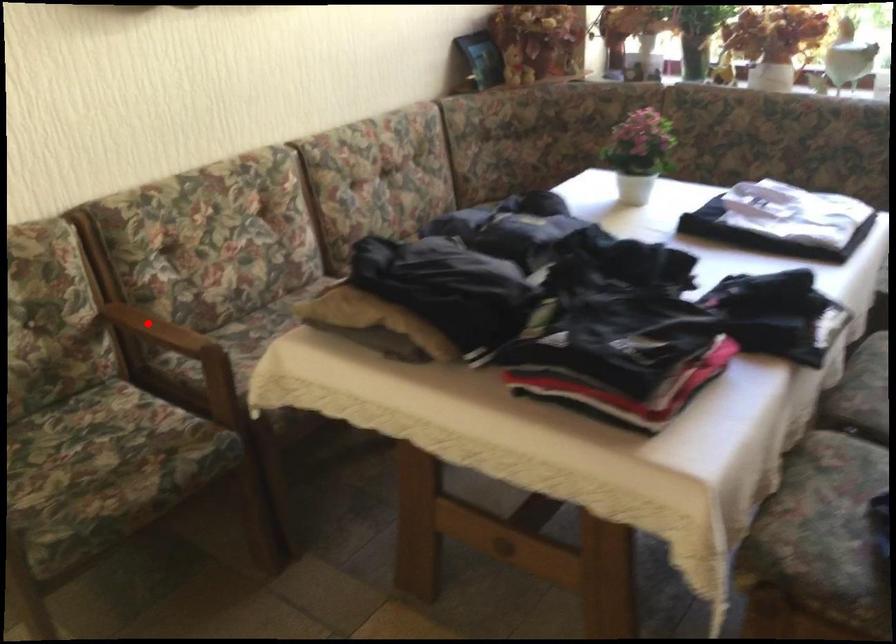
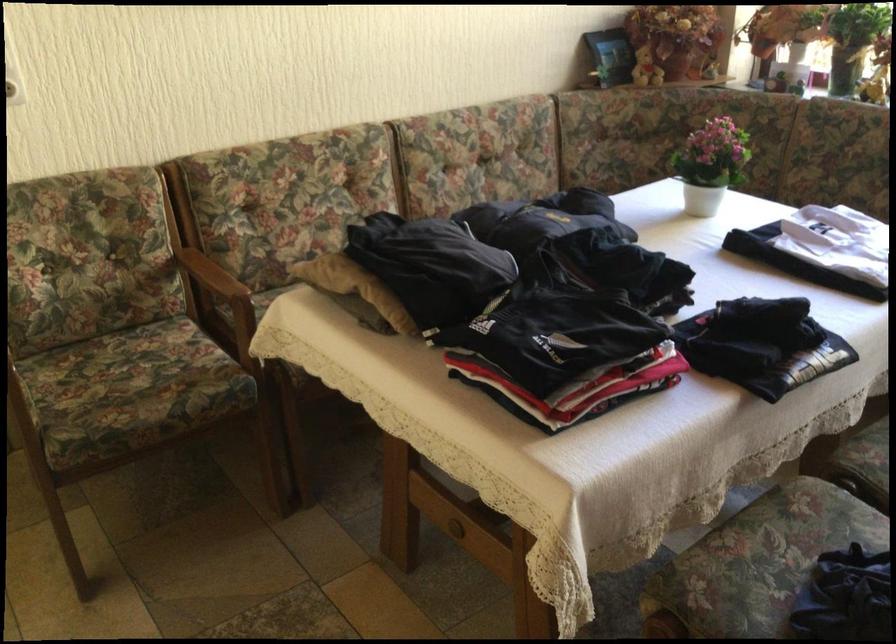
Where in the second image is the point corresponding to the highlighted location from the first image?

(204, 269)